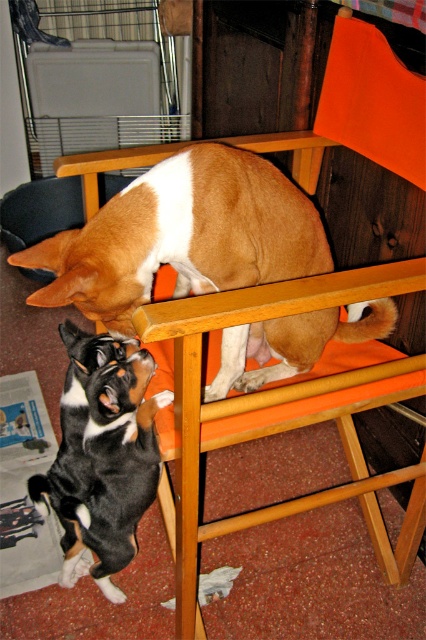
You are a small toy that is 10 inches long. You are placed between the orange fabric stool at upper center and the black and white fur at lower left. Can you fit entirely between them without overlapping either?

The distance between the orange fabric stool at upper center and the black and white fur at lower left is 12.76 inches. Since the toy is 10 inches long, it can fit entirely between them without overlapping either.

You are a pet sitter and need to ensure the brown matte dog at upper center is safely on the orange fabric stool at upper center. Is the dog currently on the stool?

The brown matte dog at upper center is positioned over orange fabric stool at upper center, so yes, the dog is currently on the stool.